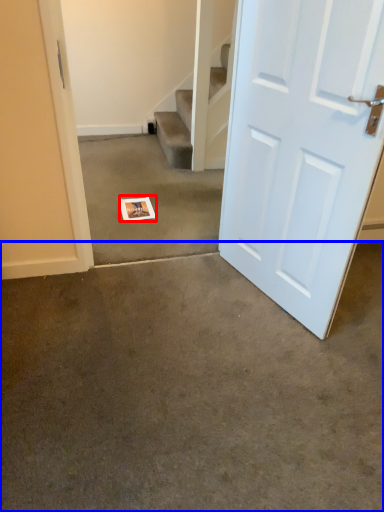
Question: Which point is further to the camera, postcard (highlighted by a red box) or concrete (highlighted by a blue box)?

Choices:
 (A) postcard
 (B) concrete

Answer: (A)